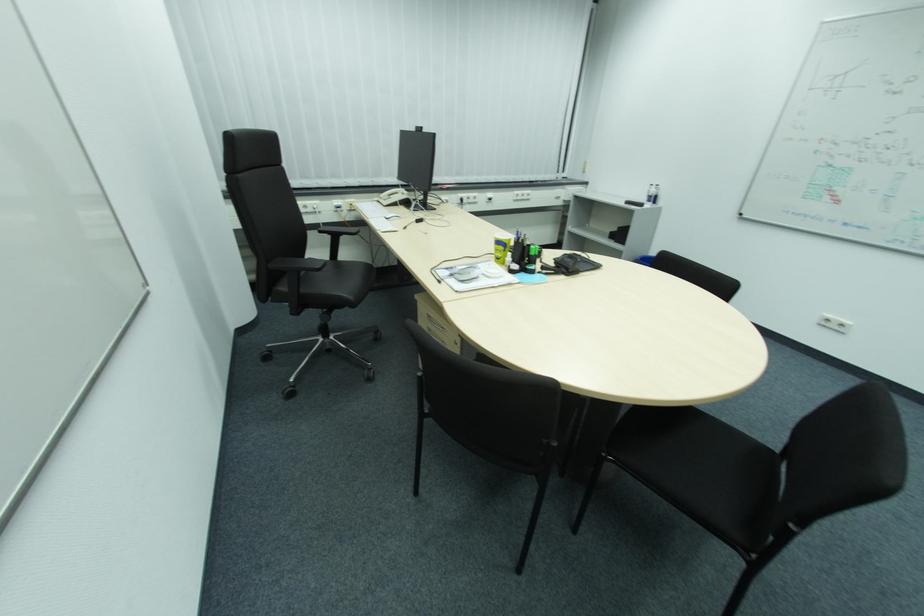
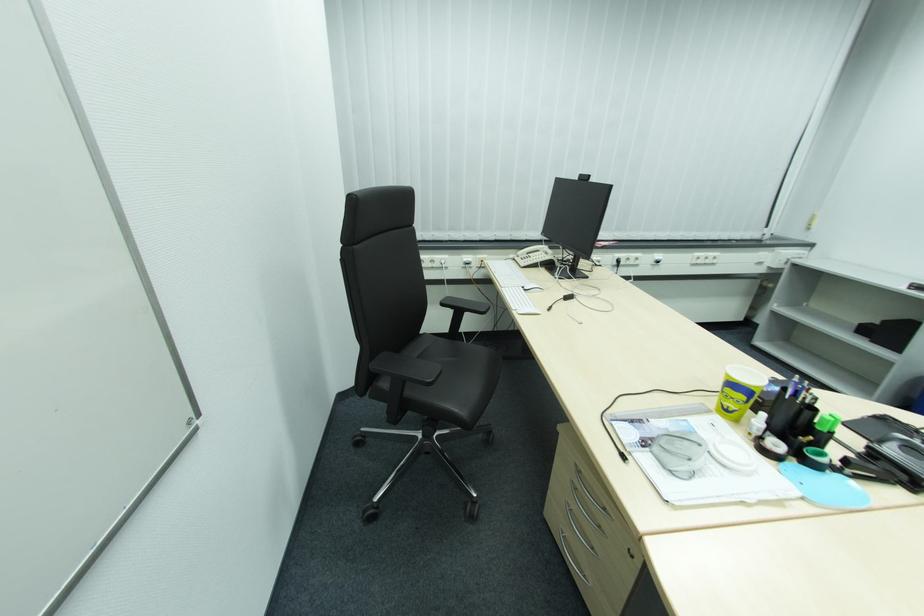
Question: The images are taken continuously from a first-person perspective. In which direction is your viewpoint rotating?

Choices:
 (A) Left
 (B) Right
 (C) Up
 (D) Down

Answer: (A)